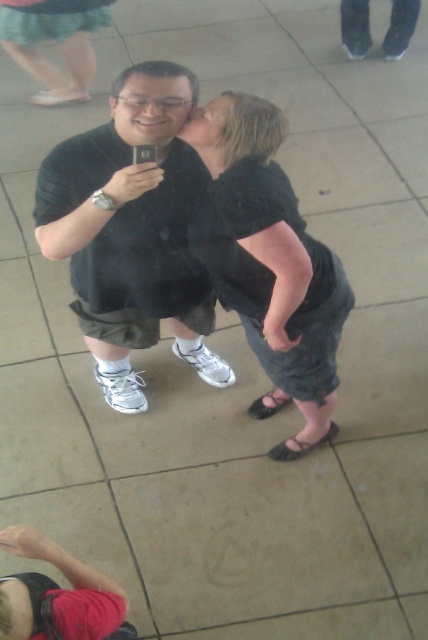
Does black cotton shirt at center have a greater width compared to matte black hair at upper center?

Correct, the width of black cotton shirt at center exceeds that of matte black hair at upper center.

Does point (226, 124) lie in front of point (226, 96)?

Yes.

Does point (323, 294) lie behind point (202, 116)?

Yes, point (323, 294) is behind point (202, 116).

The height and width of the screenshot is (640, 428). I want to click on black cotton shirt at center, so click(x=273, y=272).

Does black matte shirt at center come behind matte black face at center?

No, it is not.

Can you confirm if black matte shirt at center is smaller than matte black face at center?

Incorrect, black matte shirt at center is not smaller in size than matte black face at center.

From the picture: Who is more distant from viewer, (95, 365) or (149, 99)?

The point (95, 365) is more distant.

This screenshot has height=640, width=428. I want to click on black matte shirt at center, so click(x=131, y=230).

The width and height of the screenshot is (428, 640). I want to click on black matte shirt at center, so click(131, 230).

Can you confirm if black matte shirt at center is shorter than black cotton shirt at center?

Yes, black matte shirt at center is shorter than black cotton shirt at center.

Between point (45, 221) and point (216, 234), which one is positioned behind?

The point (45, 221) is more distant.

Find the location of a particular element. This screenshot has height=640, width=428. black matte shirt at center is located at coordinates (131, 230).